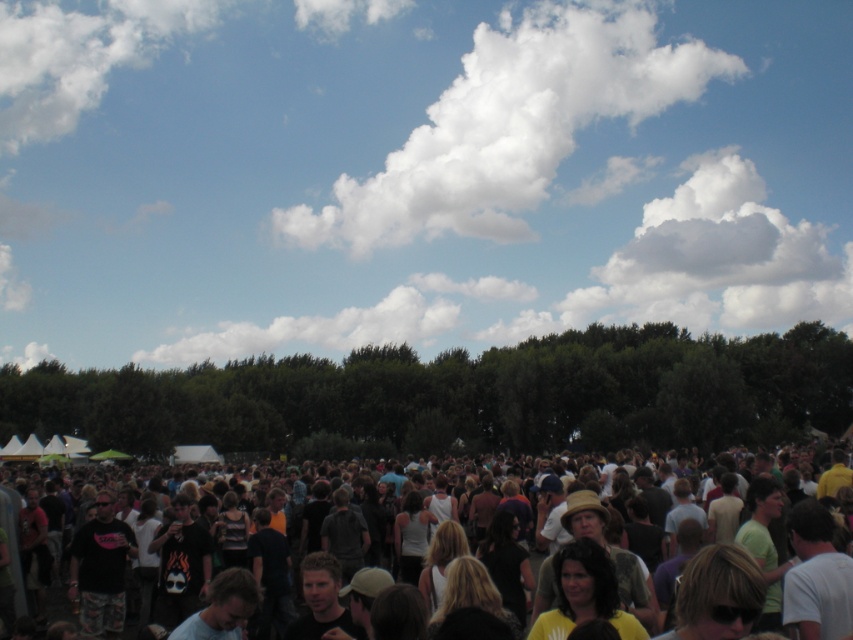
Question: Is the position of white fluffy cloud at upper center less distant than that of dark clothing crowd at center?

Choices:
 (A) yes
 (B) no

Answer: (B)

Question: Can you confirm if white fluffy cloud at upper center is thinner than dark clothing crowd at center?

Choices:
 (A) yes
 (B) no

Answer: (B)

Question: Which point is closer to the camera?

Choices:
 (A) white fluffy cloud at upper center
 (B) dark clothing crowd at center

Answer: (B)

Question: Which point is farther from the camera taking this photo?

Choices:
 (A) (554, 602)
 (B) (605, 12)

Answer: (B)

Question: Observing the image, what is the correct spatial positioning of white fluffy cloud at upper center in reference to dark clothing crowd at center?

Choices:
 (A) below
 (B) above

Answer: (B)